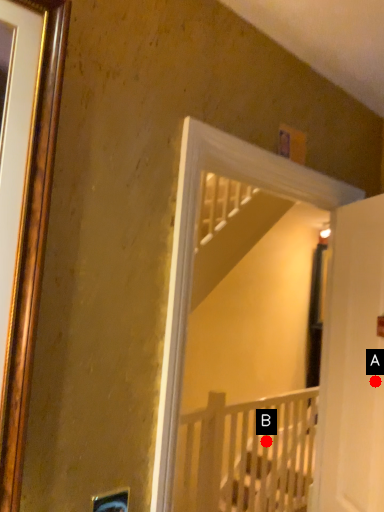
Question: Two points are circled on the image, labeled by A and B beside each circle. Among these points, which one is farthest from the camera?

Choices:
 (A) A is further
 (B) B is further

Answer: (B)